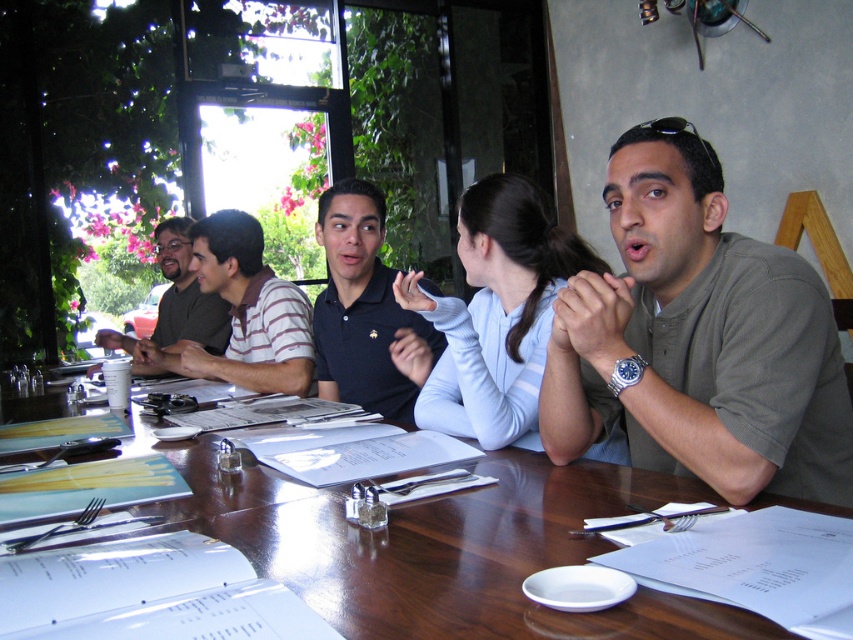
You are a photographer trying to capture a group photo of the five individuals at the dining table. You notice the green matte shirt at center and the striped cotton shirt at center. Which of these two shirts should you focus on to ensure it appears larger in the photo?

The striped cotton shirt at center is larger in size compared to the green matte shirt at center, so focusing on the striped cotton shirt at center will make it appear larger in the photo.